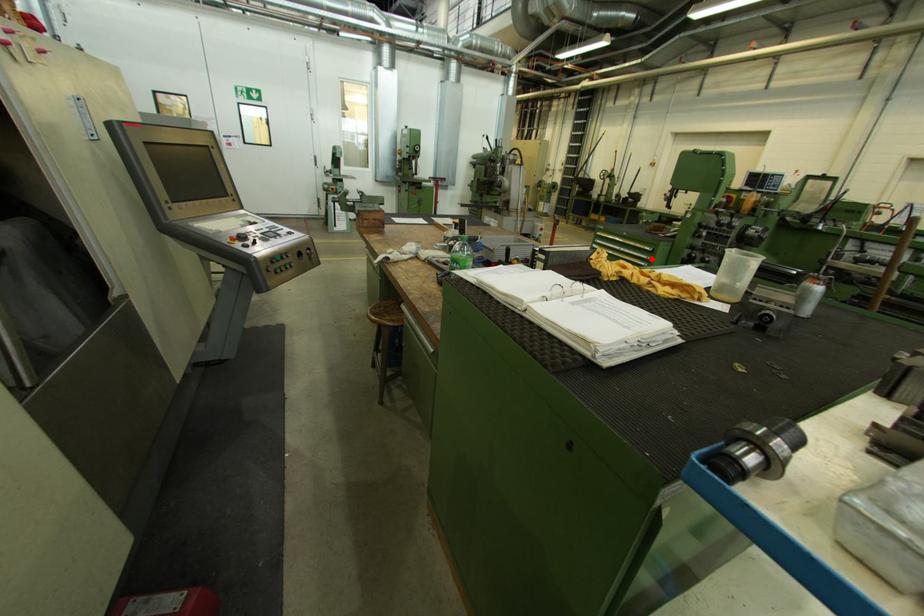
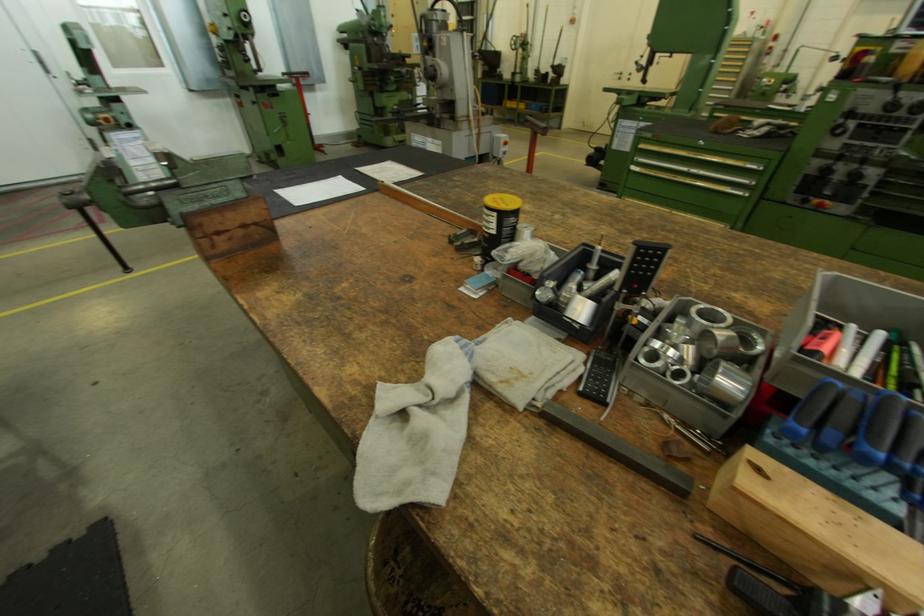
Question: I am providing you with two images of the same scene from different viewpoints. In image1, a red point is highlighted. Considering the same 3D point in image2, which of the following is correct?

Choices:
 (A) It is closer
 (B) It is farther

Answer: (A)